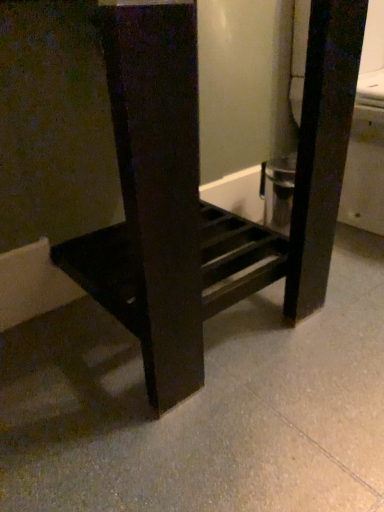
The image size is (384, 512). I want to click on free location in front of matte black shelf at lower center, so click(x=200, y=426).